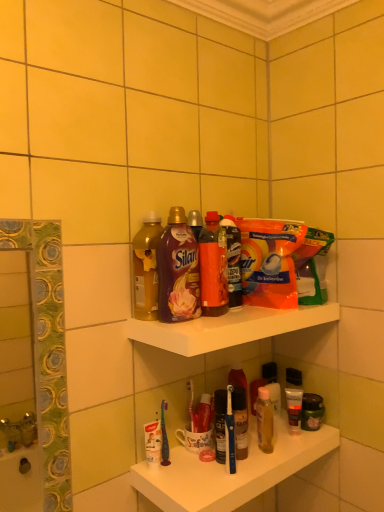
Question: Does translucent orange bottle at center, which is counted as the 3th bottle, starting from the left, come behind white glossy shelf at upper center, the first shelf from the top?

Choices:
 (A) no
 (B) yes

Answer: (B)

Question: Is translucent orange bottle at center, the first bottle when ordered from right to left, at the right side of white glossy shelf at upper center, marked as the 2th shelf in a bottom-to-top arrangement?

Choices:
 (A) no
 (B) yes

Answer: (A)

Question: Can you confirm if translucent orange bottle at center, which is counted as the 3th bottle, starting from the left, is wider than white glossy shelf at upper center, marked as the 2th shelf in a bottom-to-top arrangement?

Choices:
 (A) yes
 (B) no

Answer: (B)

Question: Is translucent orange bottle at center, which is counted as the 3th bottle, starting from the left, facing away from white glossy shelf at upper center, the first shelf from the top?

Choices:
 (A) yes
 (B) no

Answer: (B)

Question: From a real-world perspective, is translucent orange bottle at center, the first bottle when ordered from right to left, physically below white glossy shelf at upper center, marked as the 2th shelf in a bottom-to-top arrangement?

Choices:
 (A) yes
 (B) no

Answer: (B)

Question: Can you confirm if translucent orange bottle at center, the first bottle when ordered from right to left, is smaller than white glossy shelf at upper center, marked as the 2th shelf in a bottom-to-top arrangement?

Choices:
 (A) no
 (B) yes

Answer: (B)

Question: Is the position of white glossy shelf at upper center, marked as the 2th shelf in a bottom-to-top arrangement, less distant than that of orange plastic bag at upper center, the second cleaning product in the left-to-right sequence?

Choices:
 (A) yes
 (B) no

Answer: (A)

Question: From a real-world perspective, does white glossy shelf at upper center, marked as the 2th shelf in a bottom-to-top arrangement, sit lower than orange plastic bag at upper center, the second cleaning product in the left-to-right sequence?

Choices:
 (A) yes
 (B) no

Answer: (A)

Question: Does white glossy shelf at upper center, marked as the 2th shelf in a bottom-to-top arrangement, appear on the right side of orange plastic bag at upper center, marked as the 1th cleaning product in a right-to-left arrangement?

Choices:
 (A) yes
 (B) no

Answer: (B)

Question: Is white glossy shelf at upper center, marked as the 2th shelf in a bottom-to-top arrangement, smaller than orange plastic bag at upper center, the second cleaning product in the left-to-right sequence?

Choices:
 (A) yes
 (B) no

Answer: (A)

Question: Is white glossy shelf at upper center, marked as the 2th shelf in a bottom-to-top arrangement, thinner than orange plastic bag at upper center, the second cleaning product in the left-to-right sequence?

Choices:
 (A) yes
 (B) no

Answer: (A)

Question: From the image's perspective, is white glossy shelf at upper center, the first shelf from the top, above orange plastic bag at upper center, marked as the 1th cleaning product in a right-to-left arrangement?

Choices:
 (A) yes
 (B) no

Answer: (B)

Question: Is white glossy shelf at upper center, the first shelf from the top, outside translucent orange bottle at center, which is counted as the 3th bottle, starting from the left?

Choices:
 (A) no
 (B) yes

Answer: (B)